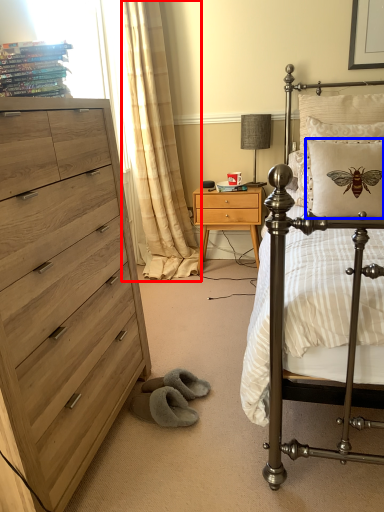
Question: Which object is further to the camera taking this photo, curtain (highlighted by a red box) or pillow (highlighted by a blue box)?

Choices:
 (A) curtain
 (B) pillow

Answer: (A)